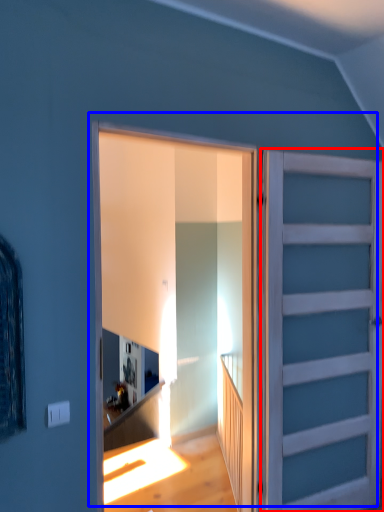
Question: Which of the following is the farthest to the observer, door (highlighted by a red box) or door (highlighted by a blue box)?

Choices:
 (A) door
 (B) door

Answer: (A)